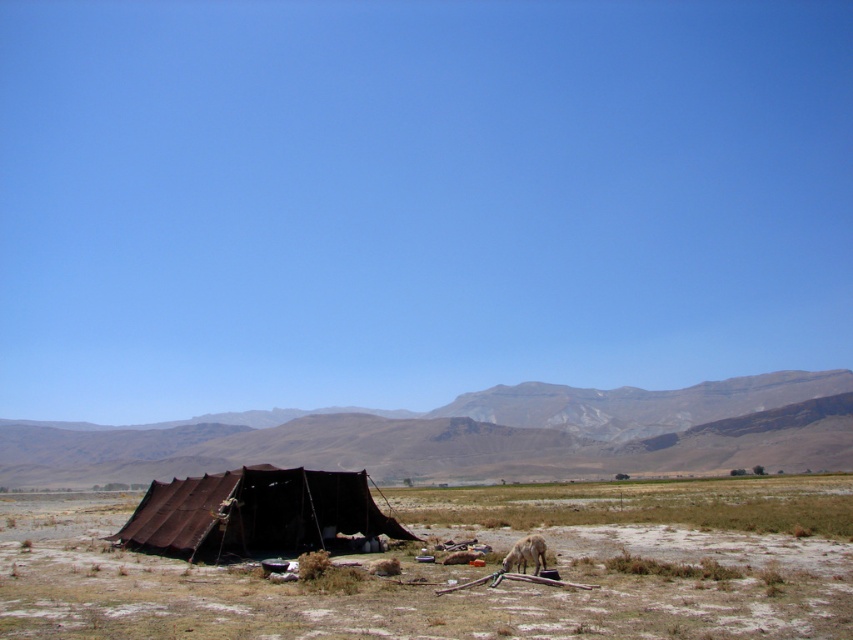
Question: Which object appears farthest from the camera in this image?

Choices:
 (A) white woolen goat at lower center
 (B) brown canvas tent at center
 (C) brown fabric tent at lower left

Answer: (B)

Question: Which is nearer to the brown canvas tent at center?

Choices:
 (A) white woolen goat at lower center
 (B) brown rocky mountain at center

Answer: (A)

Question: Which of these objects is positioned farthest from the brown canvas tent at center?

Choices:
 (A) white woolen goat at lower center
 (B) brown rocky mountain at center

Answer: (B)

Question: Does brown fabric tent at lower left appear on the right side of brown rocky mountain at center?

Choices:
 (A) yes
 (B) no

Answer: (A)

Question: Is brown fabric tent at lower left thinner than white woolen goat at lower center?

Choices:
 (A) no
 (B) yes

Answer: (A)

Question: Can you confirm if brown fabric tent at lower left is positioned to the left of brown rocky mountain at center?

Choices:
 (A) yes
 (B) no

Answer: (B)